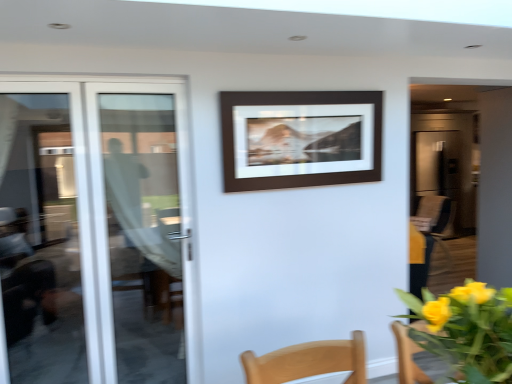
Question: Is white glass door at left, acting as the first door starting from the left, at the right side of brown matte picture frame at center?

Choices:
 (A) yes
 (B) no

Answer: (B)

Question: Considering the relative sizes of white glass door at left, acting as the first door starting from the left, and brown matte picture frame at center in the image provided, is white glass door at left, acting as the first door starting from the left, taller than brown matte picture frame at center?

Choices:
 (A) no
 (B) yes

Answer: (B)

Question: From the image's perspective, is white glass door at left, positioned as the 2th door in right-to-left order, located above brown matte picture frame at center?

Choices:
 (A) no
 (B) yes

Answer: (A)

Question: Is white glass door at left, acting as the first door starting from the left, far from brown matte picture frame at center?

Choices:
 (A) yes
 (B) no

Answer: (A)

Question: Is white glass door at left, positioned as the 2th door in right-to-left order, not inside brown matte picture frame at center?

Choices:
 (A) no
 (B) yes

Answer: (B)

Question: Which is correct: transparent glass door at left, which is the first door from right to left, is inside brown matte picture frame at center, or outside of it?

Choices:
 (A) outside
 (B) inside

Answer: (A)

Question: Does point (123, 218) appear closer or farther from the camera than point (270, 167)?

Choices:
 (A) closer
 (B) farther

Answer: (B)

Question: From a real-world perspective, relative to brown matte picture frame at center, is transparent glass door at left, which is the first door from right to left, vertically above or below?

Choices:
 (A) below
 (B) above

Answer: (A)

Question: Considering the positions of transparent glass door at left, arranged as the 2th door when viewed from the left, and brown matte picture frame at center in the image, is transparent glass door at left, arranged as the 2th door when viewed from the left, bigger or smaller than brown matte picture frame at center?

Choices:
 (A) big
 (B) small

Answer: (A)

Question: From the image's perspective, relative to brown matte picture frame at center, is yellow matte flowers at lower right above or below?

Choices:
 (A) above
 (B) below

Answer: (B)

Question: Is yellow matte flowers at lower right taller or shorter than brown matte picture frame at center?

Choices:
 (A) short
 (B) tall

Answer: (A)

Question: Looking at their shapes, would you say yellow matte flowers at lower right is wider or thinner than brown matte picture frame at center?

Choices:
 (A) wide
 (B) thin

Answer: (A)

Question: Is point (424, 299) positioned closer to the camera than point (331, 144)?

Choices:
 (A) closer
 (B) farther

Answer: (A)

Question: From a real-world perspective, is brown matte picture frame at center above or below white glass door at left, acting as the first door starting from the left?

Choices:
 (A) above
 (B) below

Answer: (A)

Question: Relative to white glass door at left, positioned as the 2th door in right-to-left order, is brown matte picture frame at center in front or behind?

Choices:
 (A) behind
 (B) front

Answer: (A)